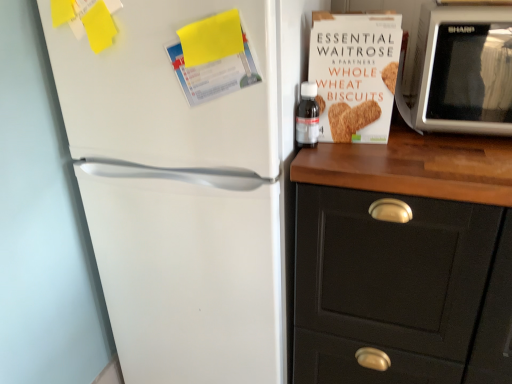
The width and height of the screenshot is (512, 384). Identify the location of vacant space in front of transparent plastic bottle at upper right. (340, 162).